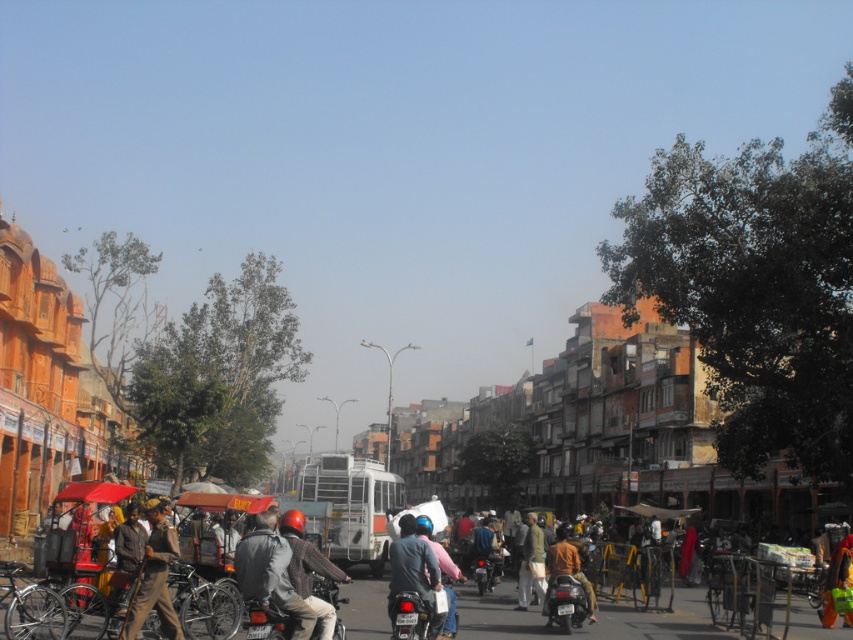
Who is positioned more to the left, silver metallic bicycle at lower left or brown fabric bag at center?

From the viewer's perspective, silver metallic bicycle at lower left appears more on the left side.

Which is below, silver metallic bicycle at lower left or brown fabric bag at center?

brown fabric bag at center is below.

Where is `silver metallic bicycle at lower left`? silver metallic bicycle at lower left is located at coordinates (73, 611).

Where is `silver metallic bicycle at lower left`? The height and width of the screenshot is (640, 853). silver metallic bicycle at lower left is located at coordinates (73, 611).

Who is higher up, blue fabric jacket at center or brown fabric bag at center?

blue fabric jacket at center is above.

Based on the photo, between blue fabric jacket at center and brown fabric bag at center, which one has less height?

Standing shorter between the two is blue fabric jacket at center.

Is point (413, 588) less distant than point (537, 564)?

That is True.

Identify the location of blue fabric jacket at center. The width and height of the screenshot is (853, 640). (415, 573).

Is dark brown leather jacket at lower left to the left of blue fabric jacket at center from the viewer's perspective?

Indeed, dark brown leather jacket at lower left is positioned on the left side of blue fabric jacket at center.

Is point (154, 586) in front of point (405, 540)?

Yes, it is in front of point (405, 540).

Locate an element on the screen. The height and width of the screenshot is (640, 853). dark brown leather jacket at lower left is located at coordinates (154, 576).